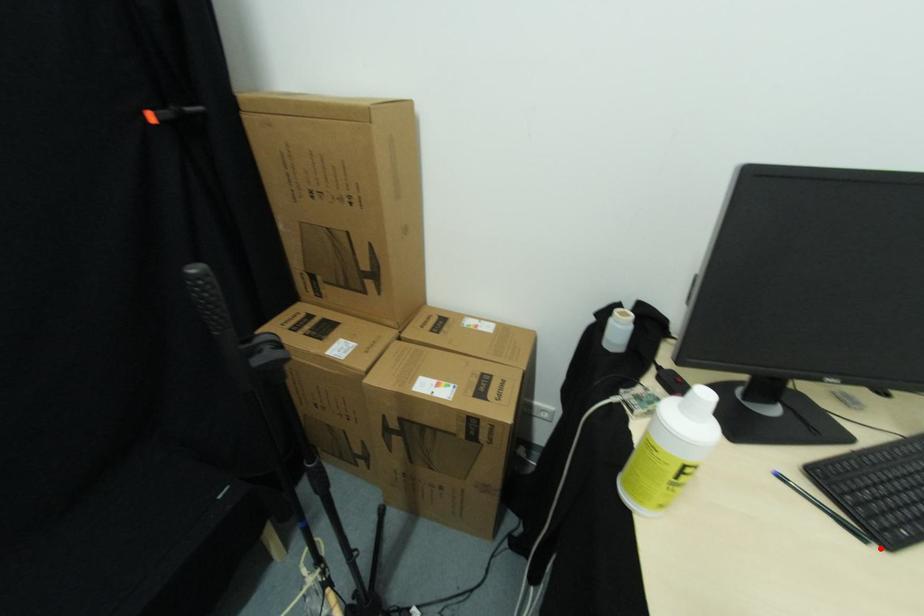
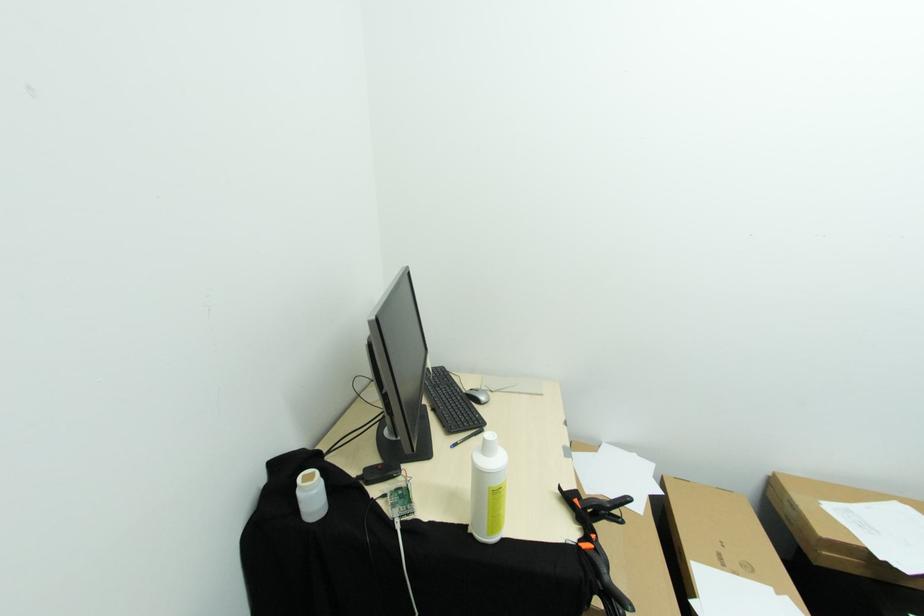
The point at the highlighted location is marked in the first image. Where is the corresponding point in the second image?

(487, 431)